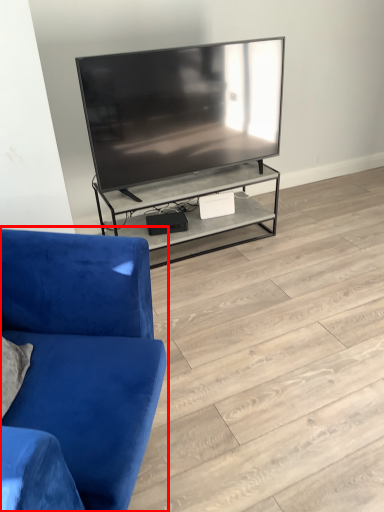
Question: From the image's perspective, what is the correct spatial positioning of studio couch (annotated by the red box) in reference to tile?

Choices:
 (A) above
 (B) below

Answer: (B)